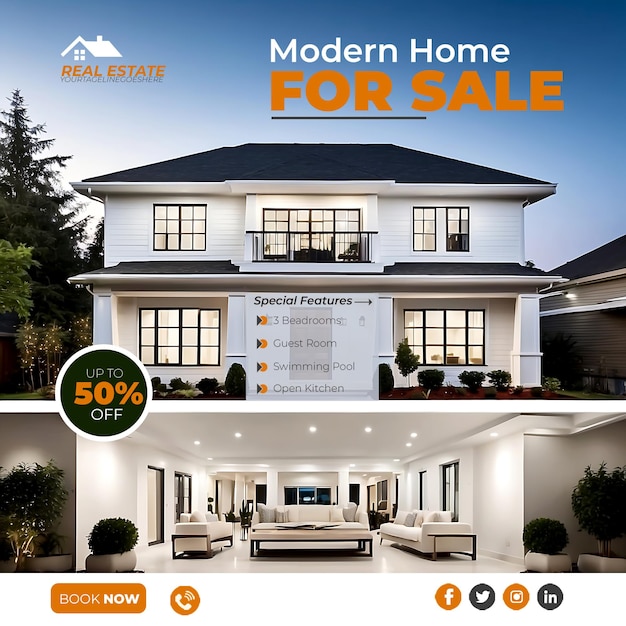
Find the location of a particular element. sofas is located at coordinates 188,529, 419,528, 320,510.